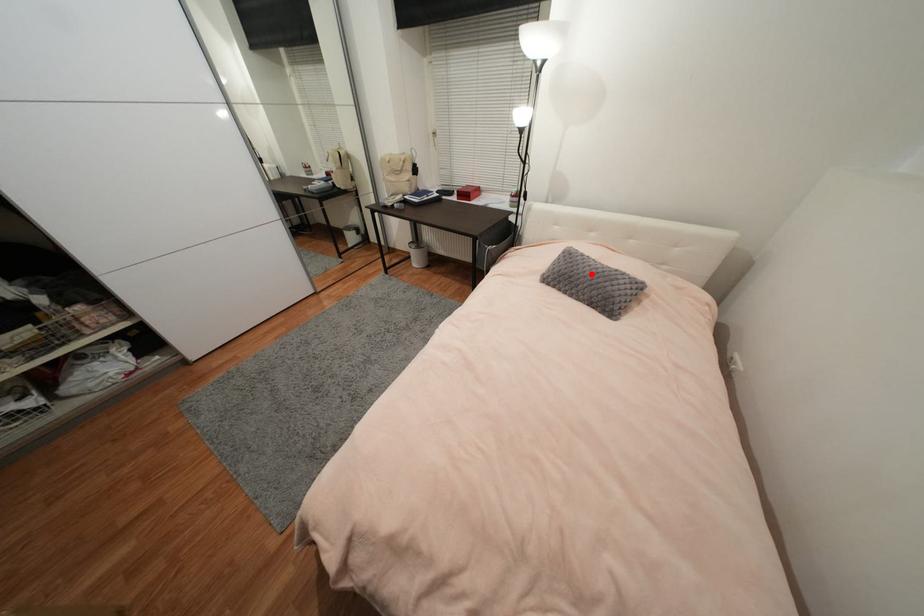
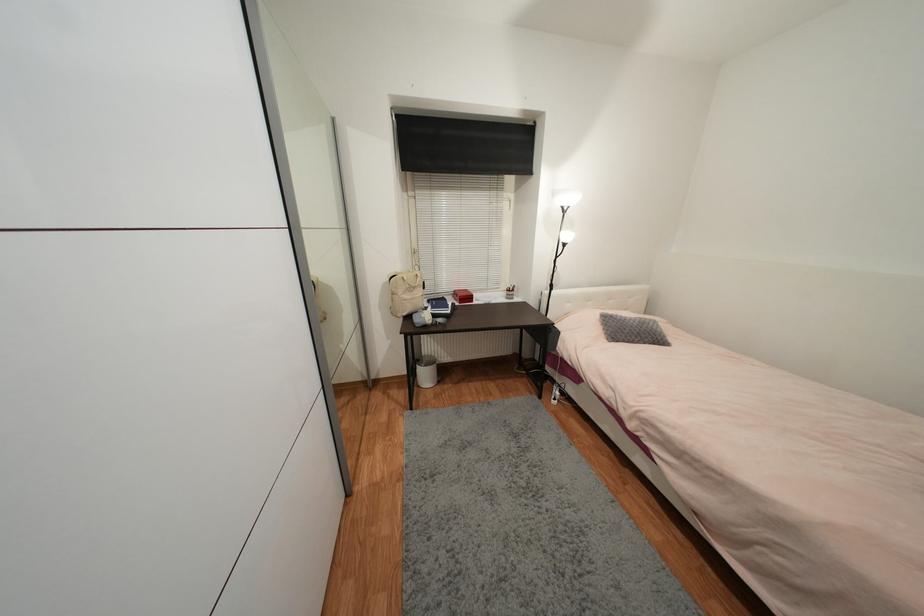
Question: I am providing you with two images of the same scene from different viewpoints. Image1 has a red point marked. In image2, the corresponding 3D location appears at what relative position? Reply with the corresponding letter.

Choices:
 (A) Closer
 (B) Farther

Answer: (B)